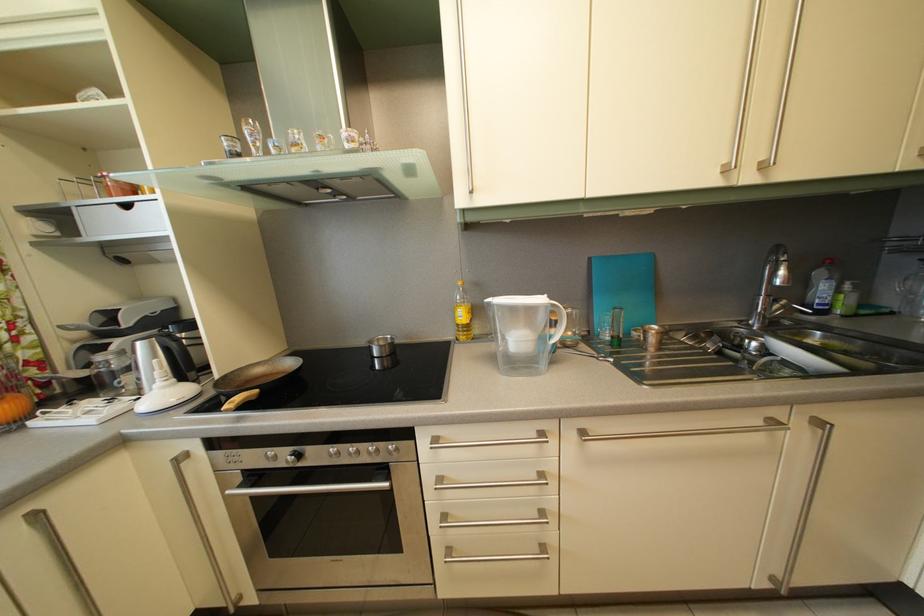
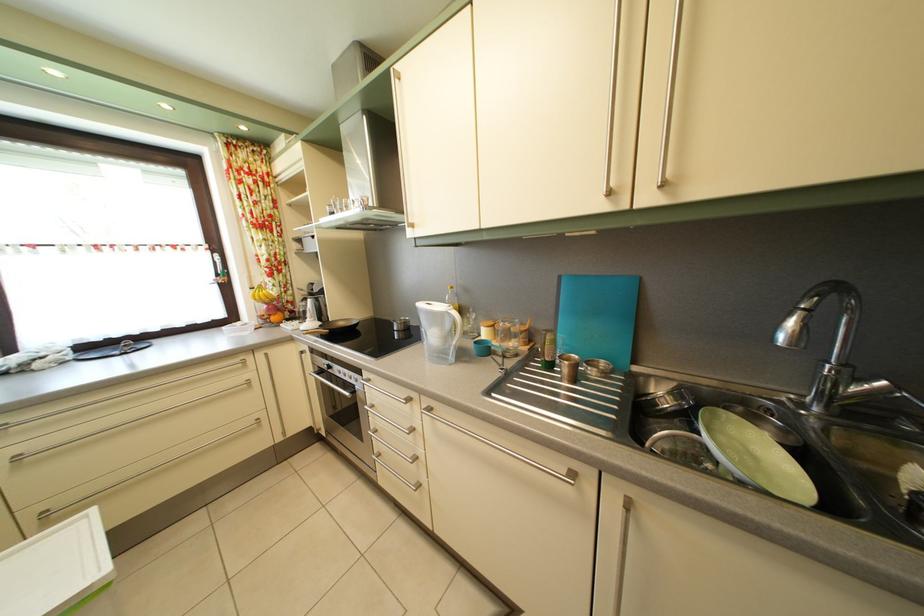
Locate, in the second image, the point that corresponds to pixel 308 464 in the first image.

(337, 374)